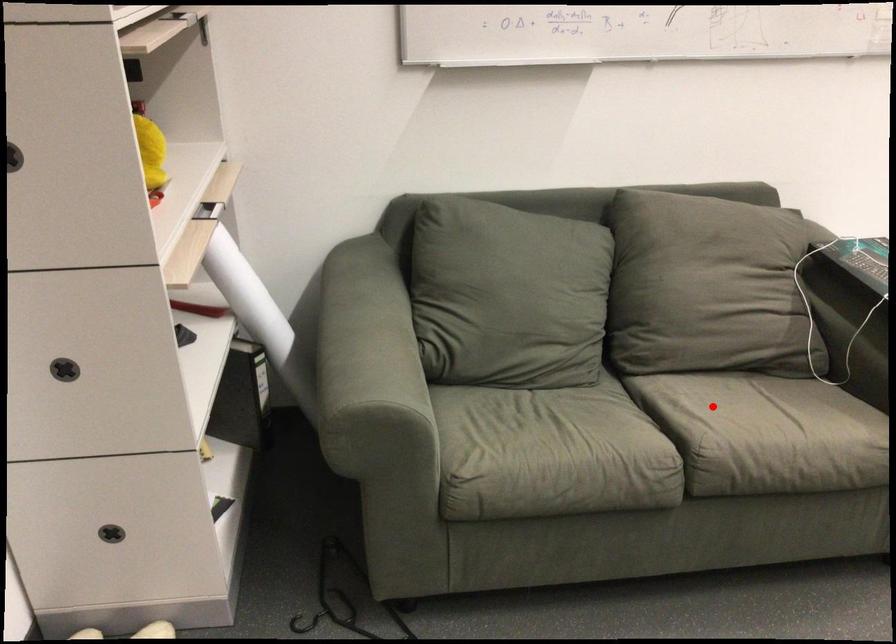
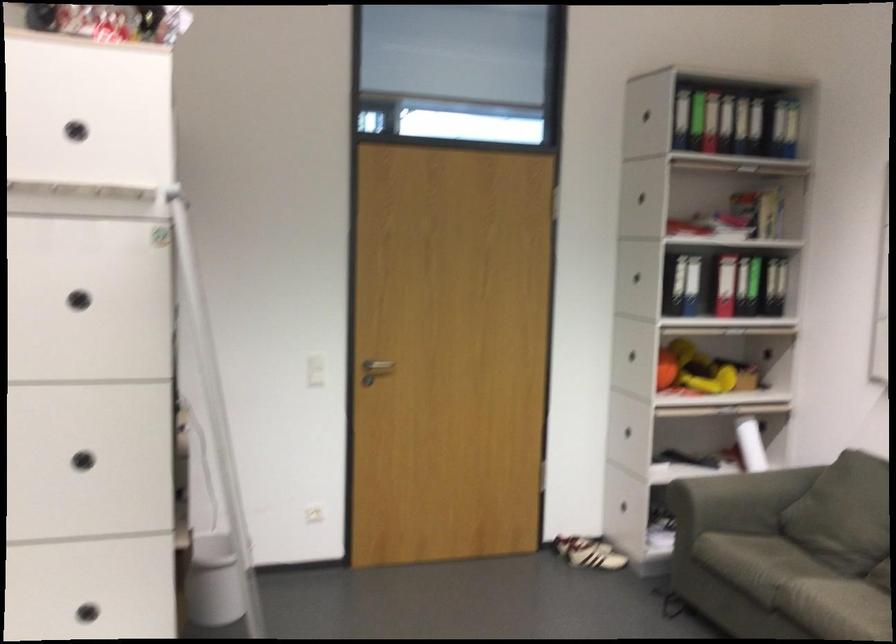
Where in the second image is the point corresponding to the highlighted location from the first image?

(832, 592)